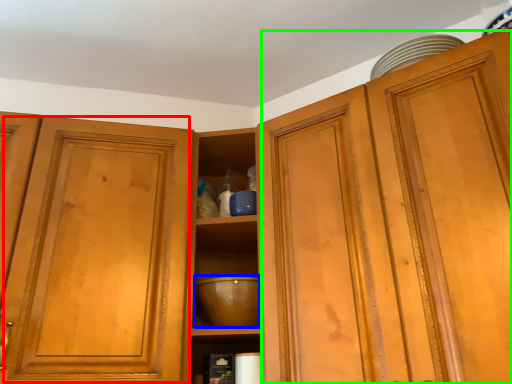
Question: Which is nearer to the glass door (highlighted by a red box)? mixing bowl (highlighted by a blue box) or cabinetry (highlighted by a green box).

Choices:
 (A) mixing bowl
 (B) cabinetry

Answer: (A)